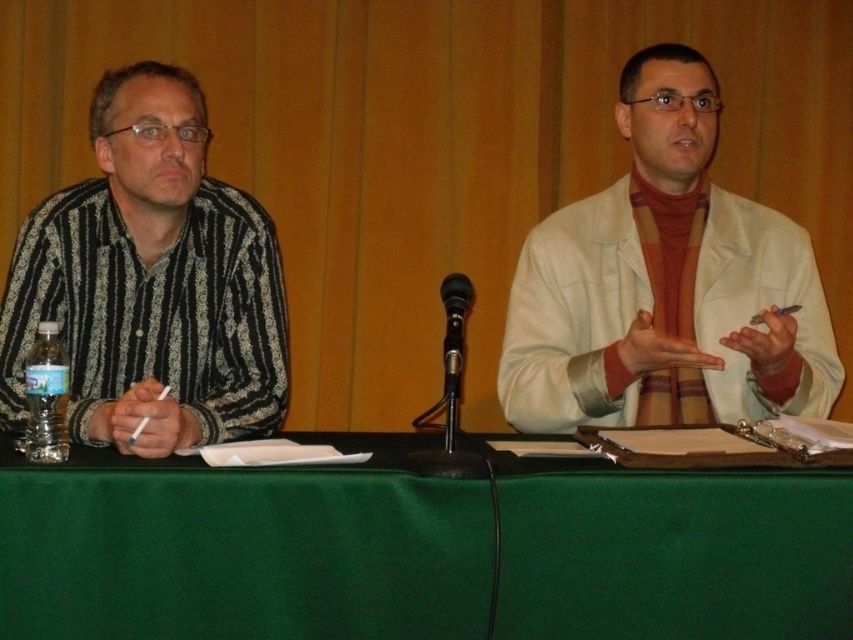
Does point (136, 593) come behind point (686, 305)?

No, it is in front of (686, 305).

Which is in front, point (6, 556) or point (642, 67)?

Point (6, 556) is more forward.

Locate an element on the screen. The width and height of the screenshot is (853, 640). green fabric table at center is located at coordinates (242, 547).

Does light beige lab coat at right lie in front of black metallic microphone at center?

No.

Between light beige lab coat at right and black metallic microphone at center, which one has less height?

Standing shorter between the two is black metallic microphone at center.

This screenshot has height=640, width=853. I want to click on light beige lab coat at right, so click(x=664, y=284).

Who is shorter, green fabric table at center or black striped shirt at left?

green fabric table at center

Is green fabric table at center taller than black striped shirt at left?

Incorrect, green fabric table at center's height is not larger of black striped shirt at left's.

Is point (421, 564) positioned before point (199, 253)?

Yes, it is.

Image resolution: width=853 pixels, height=640 pixels. Find the location of `green fabric table at center`. green fabric table at center is located at coordinates (242, 547).